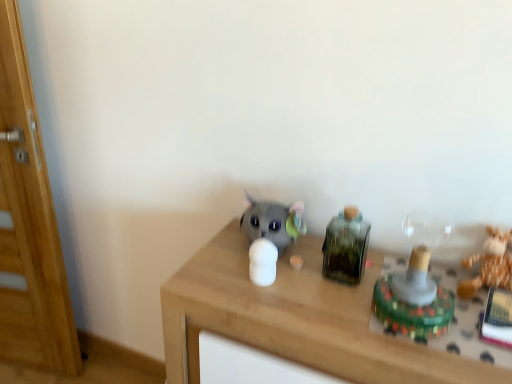
Describe the element at coordinates (346, 247) in the screenshot. The height and width of the screenshot is (384, 512). I see `green glass bottle at center-right, positioned as the second toy in left-to-right order` at that location.

Describe the element at coordinates (29, 223) in the screenshot. The width and height of the screenshot is (512, 384). I see `wooden door at left` at that location.

How much space does matte gray plush toy at center, arranged as the 4th toy when viewed from the right, occupy horizontally?

It is 5.77 inches.

The image size is (512, 384). Identify the location of green glass bottle at center-right, arranged as the third toy when viewed from the right. (346, 247).

Considering the positions of objects green glass bottle at center-right, positioned as the second toy in left-to-right order, and brown plush toy at right, which is the fourth toy from left to right, in the image provided, who is behind, green glass bottle at center-right, positioned as the second toy in left-to-right order, or brown plush toy at right, which is the fourth toy from left to right,?

green glass bottle at center-right, positioned as the second toy in left-to-right order.

How different are the orientations of green glass bottle at center-right, positioned as the second toy in left-to-right order, and brown plush toy at right, which ranks as the 1th toy in right-to-left order, in degrees?

The facing directions of green glass bottle at center-right, positioned as the second toy in left-to-right order, and brown plush toy at right, which ranks as the 1th toy in right-to-left order, are 4.56e-05 degrees apart.

Does green glass bottle at center-right, arranged as the third toy when viewed from the right, turn towards brown plush toy at right, which is the fourth toy from left to right?

No, green glass bottle at center-right, arranged as the third toy when viewed from the right, does not turn towards brown plush toy at right, which is the fourth toy from left to right.

From a real-world perspective, which object rests below the other?

From a 3D spatial view, brown plush toy at right, which is the fourth toy from left to right, is below.

Is wooden door at left beside brown plush toy at right, which ranks as the 1th toy in right-to-left order?

No, wooden door at left is not next to brown plush toy at right, which ranks as the 1th toy in right-to-left order.

Based on the photo, is wooden door at left completely or partially outside of brown plush toy at right, which ranks as the 1th toy in right-to-left order?

Yes, wooden door at left is not within brown plush toy at right, which ranks as the 1th toy in right-to-left order.

Considering the positions of points (62, 285) and (482, 263), is point (62, 285) closer to camera compared to point (482, 263)?

No, it is not.

Considering the relative sizes of wooden door at left and brown plush toy at right, which ranks as the 1th toy in right-to-left order, in the image provided, is wooden door at left bigger than brown plush toy at right, which ranks as the 1th toy in right-to-left order,?

Yes.

In the scene shown: Is wooden door at left closer to the viewer compared to wooden table at center?

No, it is behind wooden table at center.

Looking at this image, considering the relative positions of wooden door at left and wooden table at center in the image provided, is wooden door at left to the right of wooden table at center from the viewer's perspective?

In fact, wooden door at left is to the left of wooden table at center.

Is wooden door at left not inside wooden table at center?

Indeed, wooden door at left is completely outside wooden table at center.

In order to click on table on the right of wooden door at left in this screenshot , I will do `click(295, 319)`.

Is wooden table at center looking in the opposite direction of translucent plastic toy at right, the second toy positioned from the right?

That's not correct — wooden table at center is not looking away from translucent plastic toy at right, the second toy positioned from the right.

Considering the positions of point (260, 336) and point (376, 282), is point (260, 336) closer or farther from the camera than point (376, 282)?

Point (260, 336).

Is the depth of wooden table at center greater than that of translucent plastic toy at right, the third toy when ordered from left to right?

No.

Is wooden table at center located outside translucent plastic toy at right, the second toy positioned from the right?

wooden table at center lies outside translucent plastic toy at right, the second toy positioned from the right,'s area.

Is green glass bottle at center-right, arranged as the third toy when viewed from the right, positioned far away from translucent plastic toy at right, the second toy positioned from the right?

No, there isn't a large distance between green glass bottle at center-right, arranged as the third toy when viewed from the right, and translucent plastic toy at right, the second toy positioned from the right.

Considering the points (338, 266) and (433, 237), which point is behind, point (338, 266) or point (433, 237)?

The point (433, 237) is more distant.

Which object is positioned more to the left, green glass bottle at center-right, arranged as the third toy when viewed from the right, or translucent plastic toy at right, the third toy when ordered from left to right?

From the viewer's perspective, green glass bottle at center-right, arranged as the third toy when viewed from the right, appears more on the left side.

From the image's perspective, is green glass bottle at center-right, arranged as the third toy when viewed from the right, over translucent plastic toy at right, the second toy positioned from the right?

Yes.

Is translucent plastic toy at right, the second toy positioned from the right, thinner than brown plush toy at right, which is the fourth toy from left to right?

Incorrect, the width of translucent plastic toy at right, the second toy positioned from the right, is not less than that of brown plush toy at right, which is the fourth toy from left to right.

From a real-world perspective, is translucent plastic toy at right, the second toy positioned from the right, under brown plush toy at right, which ranks as the 1th toy in right-to-left order?

No.

From the image's perspective, is translucent plastic toy at right, the second toy positioned from the right, under brown plush toy at right, which is the fourth toy from left to right?

Yes, from the image's perspective, translucent plastic toy at right, the second toy positioned from the right, is below brown plush toy at right, which is the fourth toy from left to right.

From a real-world perspective, between translucent plastic toy at right, the second toy positioned from the right, and green glass bottle at center-right, positioned as the second toy in left-to-right order, who is vertically lower?

translucent plastic toy at right, the second toy positioned from the right.

Could you measure the distance between translucent plastic toy at right, the second toy positioned from the right, and green glass bottle at center-right, positioned as the second toy in left-to-right order?

translucent plastic toy at right, the second toy positioned from the right, is 6.25 inches away from green glass bottle at center-right, positioned as the second toy in left-to-right order.

From the image's perspective, which object appears higher, translucent plastic toy at right, the third toy when ordered from left to right, or green glass bottle at center-right, positioned as the second toy in left-to-right order?

From the image's view, green glass bottle at center-right, positioned as the second toy in left-to-right order, is above.

This screenshot has height=384, width=512. Identify the location of the 1st toy in front of the green glass bottle at center-right, arranged as the third toy when viewed from the right. (489, 264).

Image resolution: width=512 pixels, height=384 pixels. I want to click on glass door below the brown plush toy at right, which ranks as the 1th toy in right-to-left order (from a real-world perspective), so click(29, 223).

Which object lies further to the anchor point matte gray plush toy at center, arranged as the 4th toy when viewed from the right, green glass bottle at center-right, positioned as the second toy in left-to-right order, or brown plush toy at right, which ranks as the 1th toy in right-to-left order?

brown plush toy at right, which ranks as the 1th toy in right-to-left order, is further to matte gray plush toy at center, arranged as the 4th toy when viewed from the right.

When comparing their distances from brown plush toy at right, which ranks as the 1th toy in right-to-left order, does translucent plastic toy at right, the third toy when ordered from left to right, or green glass bottle at center-right, positioned as the second toy in left-to-right order, seem further?

Among the two, green glass bottle at center-right, positioned as the second toy in left-to-right order, is located further to brown plush toy at right, which ranks as the 1th toy in right-to-left order.

Estimate the real-world distances between objects in this image. Which object is further from matte gray plush toy at center, arranged as the 4th toy when viewed from the right, brown plush toy at right, which ranks as the 1th toy in right-to-left order, or translucent plastic toy at right, the second toy positioned from the right?

brown plush toy at right, which ranks as the 1th toy in right-to-left order, is further to matte gray plush toy at center, arranged as the 4th toy when viewed from the right.

Considering their positions, is translucent plastic toy at right, the third toy when ordered from left to right, positioned further to wooden table at center than brown plush toy at right, which is the fourth toy from left to right?

Based on the image, brown plush toy at right, which is the fourth toy from left to right, appears to be further to wooden table at center.

Looking at the image, which one is located further to brown plush toy at right, which is the fourth toy from left to right, matte gray plush toy at center, arranged as the 4th toy when viewed from the right, or wooden table at center?

matte gray plush toy at center, arranged as the 4th toy when viewed from the right, is further to brown plush toy at right, which is the fourth toy from left to right.

When comparing their distances from translucent plastic toy at right, the second toy positioned from the right, does brown plush toy at right, which ranks as the 1th toy in right-to-left order, or wooden table at center seem further?

wooden table at center.

Which object lies nearer to the anchor point matte gray plush toy at center, positioned as the 1th toy in left-to-right order, green glass bottle at center-right, arranged as the third toy when viewed from the right, or wooden table at center?

wooden table at center lies closer to matte gray plush toy at center, positioned as the 1th toy in left-to-right order, than the other object.

Estimate the real-world distances between objects in this image. Which object is further from wooden door at left, brown plush toy at right, which is the fourth toy from left to right, or green glass bottle at center-right, positioned as the second toy in left-to-right order?

brown plush toy at right, which is the fourth toy from left to right, is further to wooden door at left.

Locate an element on the screen. The width and height of the screenshot is (512, 384). table located between wooden door at left and green glass bottle at center-right, arranged as the third toy when viewed from the right, in the left-right direction is located at coordinates (295, 319).

Find the location of `toy situated between green glass bottle at center-right, positioned as the second toy in left-to-right order, and brown plush toy at right, which is the fourth toy from left to right, from left to right`. toy situated between green glass bottle at center-right, positioned as the second toy in left-to-right order, and brown plush toy at right, which is the fourth toy from left to right, from left to right is located at coordinates (416, 285).

The width and height of the screenshot is (512, 384). In order to click on table between matte gray plush toy at center, positioned as the 1th toy in left-to-right order, and brown plush toy at right, which ranks as the 1th toy in right-to-left order, from left to right in this screenshot , I will do `click(295, 319)`.

This screenshot has width=512, height=384. Find the location of `toy between brown plush toy at right, which ranks as the 1th toy in right-to-left order, and wooden table at center in the up-down direction`. toy between brown plush toy at right, which ranks as the 1th toy in right-to-left order, and wooden table at center in the up-down direction is located at coordinates (416, 285).